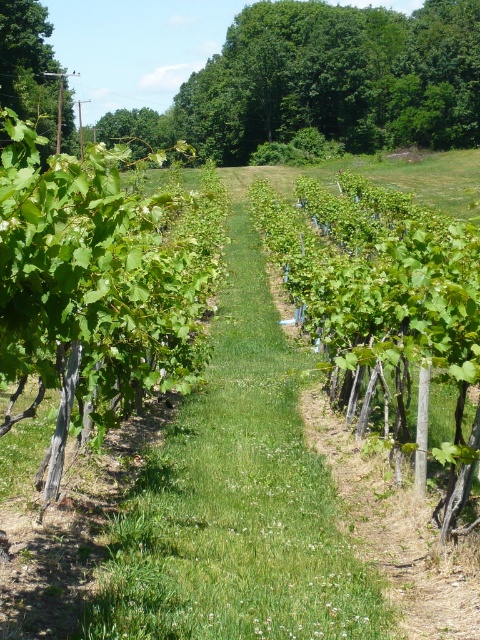
Question: Can you confirm if green leafy tree at upper center is positioned to the left of green leafy tree at upper left?

Choices:
 (A) no
 (B) yes

Answer: (A)

Question: Which of the following is the closest to the observer?

Choices:
 (A) (309, 8)
 (B) (34, 3)

Answer: (B)

Question: Considering the relative positions of green leafy tree at upper center and green leafy tree at upper left in the image provided, where is green leafy tree at upper center located with respect to green leafy tree at upper left?

Choices:
 (A) left
 (B) right

Answer: (B)

Question: Can you confirm if green leafy tree at upper center is positioned below green leafy tree at upper left?

Choices:
 (A) yes
 (B) no

Answer: (B)